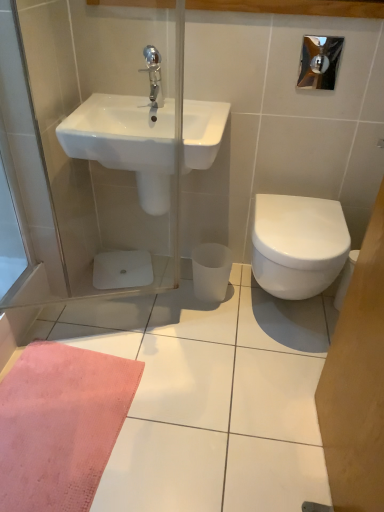
Question: Is chrome metallic faucet at upper center closer to the viewer compared to white glossy bidet at right?

Choices:
 (A) no
 (B) yes

Answer: (A)

Question: Is chrome metallic faucet at upper center shorter than white glossy bidet at right?

Choices:
 (A) yes
 (B) no

Answer: (A)

Question: Is chrome metallic faucet at upper center oriented towards white glossy bidet at right?

Choices:
 (A) yes
 (B) no

Answer: (B)

Question: From a real-world perspective, is chrome metallic faucet at upper center on top of white glossy bidet at right?

Choices:
 (A) yes
 (B) no

Answer: (A)

Question: Considering the relative sizes of chrome metallic faucet at upper center and white glossy bidet at right in the image provided, is chrome metallic faucet at upper center smaller than white glossy bidet at right?

Choices:
 (A) no
 (B) yes

Answer: (B)

Question: From a real-world perspective, is chrome metallic faucet at upper center below white glossy bidet at right?

Choices:
 (A) no
 (B) yes

Answer: (A)

Question: Is white glossy sink at upper left closer to the viewer compared to chrome metallic faucet at upper center?

Choices:
 (A) no
 (B) yes

Answer: (B)

Question: Is white glossy sink at upper left positioned far away from chrome metallic faucet at upper center?

Choices:
 (A) yes
 (B) no

Answer: (B)

Question: From a real-world perspective, is white glossy sink at upper left on top of chrome metallic faucet at upper center?

Choices:
 (A) yes
 (B) no

Answer: (B)

Question: Can you confirm if white glossy sink at upper left is thinner than chrome metallic faucet at upper center?

Choices:
 (A) no
 (B) yes

Answer: (A)

Question: Does white glossy sink at upper left have a lesser height compared to chrome metallic faucet at upper center?

Choices:
 (A) yes
 (B) no

Answer: (B)

Question: From the image's perspective, does white glossy sink at upper left appear lower than chrome metallic faucet at upper center?

Choices:
 (A) no
 (B) yes

Answer: (B)

Question: Considering the relative positions of white glossy bidet at right and white glossy sink at upper left in the image provided, is white glossy bidet at right to the right of white glossy sink at upper left from the viewer's perspective?

Choices:
 (A) no
 (B) yes

Answer: (B)